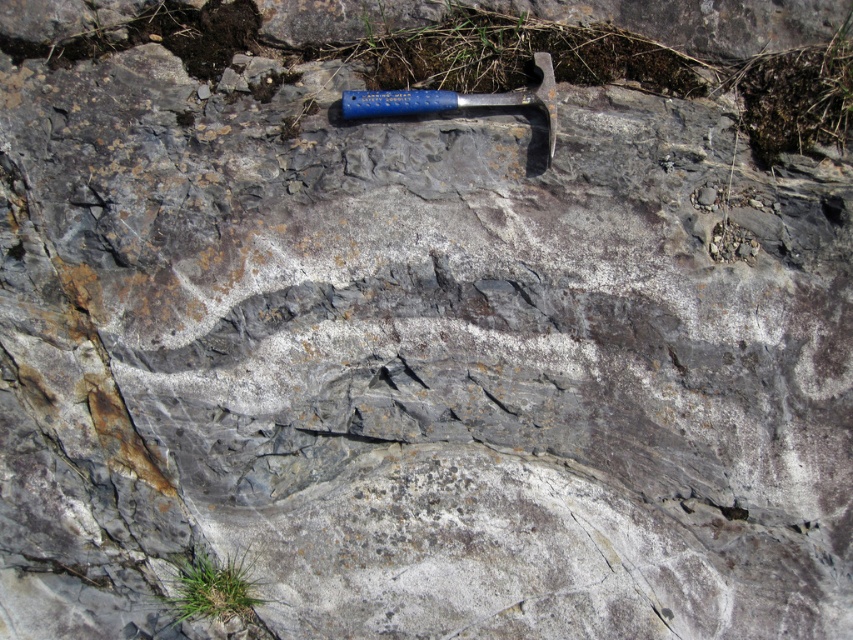
Can you confirm if blue plastic hammer at center is positioned to the left of blue metallic hammer at upper center?

In fact, blue plastic hammer at center is to the right of blue metallic hammer at upper center.

Who is more forward, (555, 120) or (405, 104)?

Point (555, 120) is more forward.

Between point (526, 104) and point (407, 109), which one is positioned in front?

Point (407, 109)

The image size is (853, 640). I want to click on blue plastic hammer at center, so click(x=491, y=99).